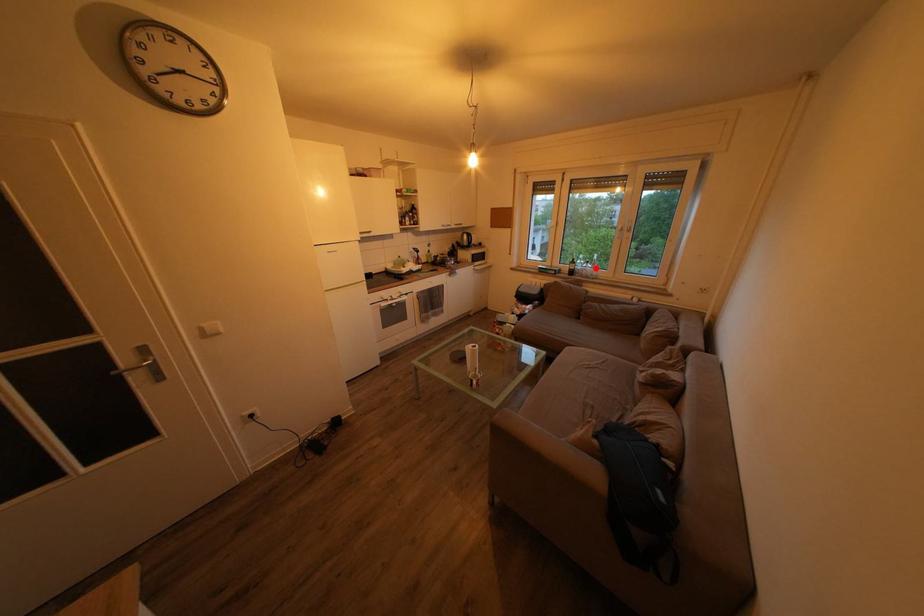
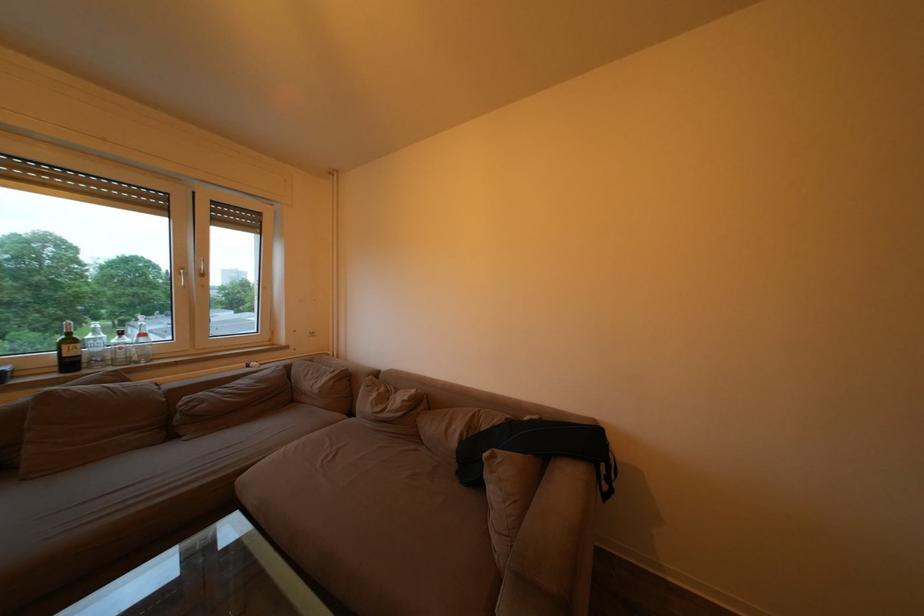
Find the pixel in the second image that matches the highlighted location in the first image.

(129, 339)